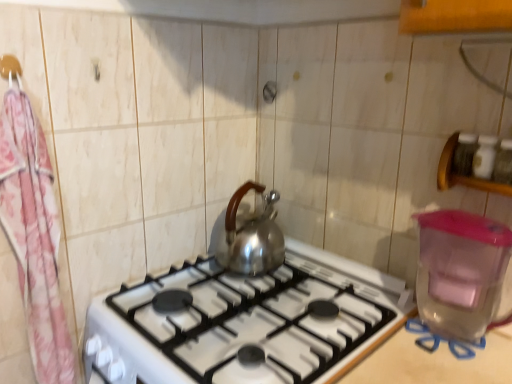
You are a GUI agent. You are given a task and a screenshot of the screen. Output one action in this format:
    pyautogui.click(x=<x>, y=<y>)
    Task: Click on the pink floral fabric at left
    This screenshot has height=384, width=512.
    Given the screenshot: What is the action you would take?
    pyautogui.click(x=34, y=236)

This screenshot has height=384, width=512. I want to click on pink fabric hanger at upper left, so click(11, 69).

Based on their positions, is satin silver gas stove at center located to the left or right of pink floral fabric at left?

From the image, it's evident that satin silver gas stove at center is to the right of pink floral fabric at left.

From the image's perspective, which object appears higher, satin silver gas stove at center or pink floral fabric at left?

From the image's view, pink floral fabric at left is above.

How distant is satin silver gas stove at center from pink floral fabric at left?

15.76 inches.

Is satin silver gas stove at center not near pink floral fabric at left?

They are positioned close to each other.

Based on the photo, are satin silver gas stove at center and transparent plastic water heater at right located far from each other?

satin silver gas stove at center is actually quite close to transparent plastic water heater at right.

Which of these two, satin silver gas stove at center or transparent plastic water heater at right, is thinner?

With smaller width is transparent plastic water heater at right.

From the image's perspective, would you say satin silver gas stove at center is positioned over transparent plastic water heater at right?

No, from the image's perspective, satin silver gas stove at center is not over transparent plastic water heater at right.

Is satin silver gas stove at center facing towards transparent plastic water heater at right?

No, satin silver gas stove at center is not facing towards transparent plastic water heater at right.

Who is shorter, transparent plastic water heater at right or pink floral fabric at left?

transparent plastic water heater at right is shorter.

From the image's perspective, relative to pink floral fabric at left, is transparent plastic water heater at right above or below?

Based on their image positions, transparent plastic water heater at right is located beneath pink floral fabric at left.

Can you confirm if transparent plastic water heater at right is positioned to the right of pink floral fabric at left?

Yes, transparent plastic water heater at right is to the right of pink floral fabric at left.

From the picture: Is satin silver gas stove at center directly adjacent to pink fabric hanger at upper left?

No, satin silver gas stove at center is not with pink fabric hanger at upper left.

Is satin silver gas stove at center facing towards pink fabric hanger at upper left?

No, satin silver gas stove at center does not turn towards pink fabric hanger at upper left.

From the image's perspective, which one is positioned higher, satin silver gas stove at center or pink fabric hanger at upper left?

pink fabric hanger at upper left appears higher in the image.

From a real-world perspective, which object rests below the other?

From a 3D spatial view, pink floral fabric at left is below.

Based on the photo, is pink floral fabric at left completely or partially outside of pink fabric hanger at upper left?

pink floral fabric at left is positioned outside pink fabric hanger at upper left.

Is pink floral fabric at left aimed at pink fabric hanger at upper left?

No.

Is transparent plastic water heater at right aimed at satin silver gas stove at center?

No, transparent plastic water heater at right is not turned towards satin silver gas stove at center.

Which of these two, transparent plastic water heater at right or satin silver gas stove at center, stands taller?

With more height is transparent plastic water heater at right.

Looking at the image, does transparent plastic water heater at right seem bigger or smaller compared to satin silver gas stove at center?

In the image, transparent plastic water heater at right appears to be smaller than satin silver gas stove at center.

From the image's perspective, is pink fabric hanger at upper left beneath pink floral fabric at left?

No, from the image's perspective, pink fabric hanger at upper left is not beneath pink floral fabric at left.

Does pink fabric hanger at upper left lie in front of pink floral fabric at left?

No, it is behind pink floral fabric at left.

Could you tell me if pink fabric hanger at upper left is turned towards pink floral fabric at left?

Yes, pink fabric hanger at upper left is facing pink floral fabric at left.

Where is `hanger above the pink floral fabric at left (from the image's perspective)`? This screenshot has height=384, width=512. hanger above the pink floral fabric at left (from the image's perspective) is located at coordinates (11, 69).

Identify the location of gas stove on the right of pink floral fabric at left. (247, 322).

Identify the location of water heater above the satin silver gas stove at center (from the image's perspective). Image resolution: width=512 pixels, height=384 pixels. (460, 271).

When comparing their distances from transparent plastic water heater at right, does satin silver gas stove at center or pink fabric hanger at upper left seem closer?

Among the two, satin silver gas stove at center is located nearer to transparent plastic water heater at right.

Considering their positions, is satin silver gas stove at center positioned closer to pink fabric hanger at upper left than transparent plastic water heater at right?

satin silver gas stove at center is closer to pink fabric hanger at upper left.

Looking at the image, which one is located closer to pink fabric hanger at upper left, transparent plastic water heater at right or satin silver gas stove at center?

Among the two, satin silver gas stove at center is located nearer to pink fabric hanger at upper left.

When comparing their distances from pink floral fabric at left, does transparent plastic water heater at right or satin silver gas stove at center seem further?

transparent plastic water heater at right lies further to pink floral fabric at left than the other object.

Estimate the real-world distances between objects in this image. Which object is further from pink fabric hanger at upper left, satin silver gas stove at center or pink floral fabric at left?

The object further to pink fabric hanger at upper left is satin silver gas stove at center.

From the image, which object appears to be farther from satin silver gas stove at center, transparent plastic water heater at right or pink fabric hanger at upper left?

pink fabric hanger at upper left is further to satin silver gas stove at center.

From the image, which object appears to be nearer to pink floral fabric at left, pink fabric hanger at upper left or satin silver gas stove at center?

Based on the image, pink fabric hanger at upper left appears to be nearer to pink floral fabric at left.

Considering their positions, is pink floral fabric at left positioned further to pink fabric hanger at upper left than satin silver gas stove at center?

satin silver gas stove at center.

The width and height of the screenshot is (512, 384). Identify the location of gas stove between pink fabric hanger at upper left and transparent plastic water heater at right in the horizontal direction. (247, 322).

Locate an element on the screen. gas stove between pink floral fabric at left and transparent plastic water heater at right is located at coordinates (247, 322).

Where is `curtain between pink fabric hanger at upper left and transparent plastic water heater at right`? This screenshot has height=384, width=512. curtain between pink fabric hanger at upper left and transparent plastic water heater at right is located at coordinates (34, 236).

The image size is (512, 384). In order to click on curtain between pink fabric hanger at upper left and satin silver gas stove at center in the up-down direction in this screenshot , I will do `click(34, 236)`.